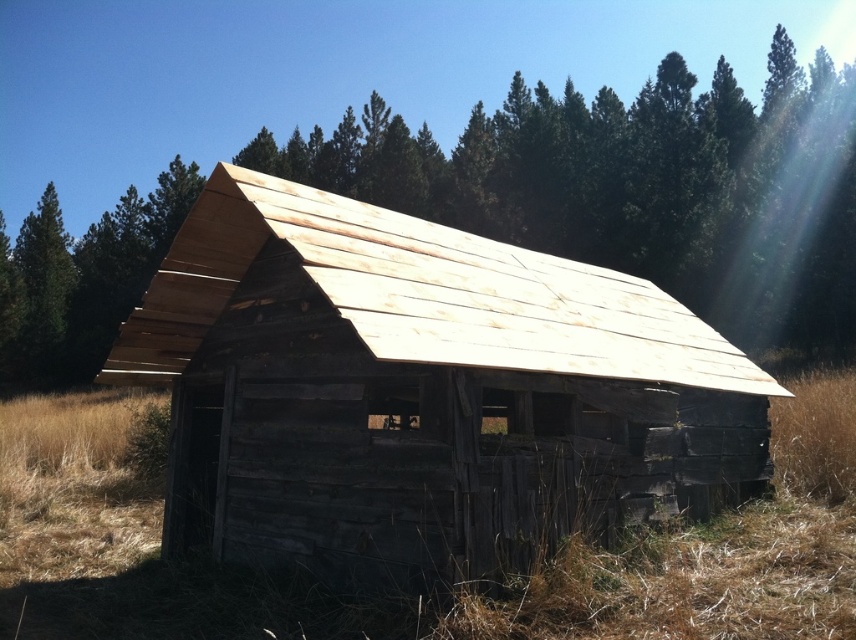
In the scene shown: Can you confirm if weathered wood barn at center is bigger than brown wooden roof at center?

Incorrect, weathered wood barn at center is not larger than brown wooden roof at center.

Is point (324, 308) positioned in front of point (658, 216)?

Yes.

Identify the location of weathered wood barn at center. (421, 392).